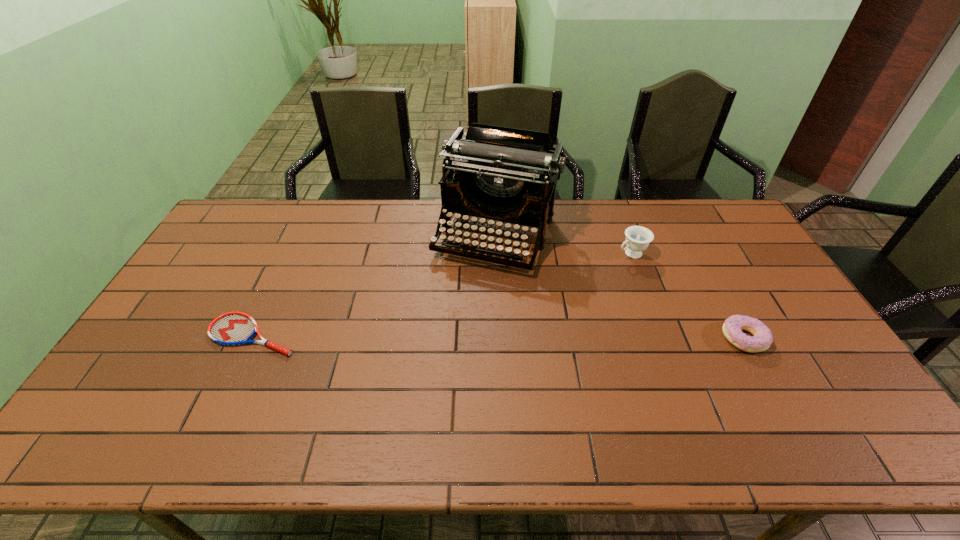
Locate an element on the screen. The image size is (960, 540). free space at the left edge is located at coordinates (241, 258).

This screenshot has height=540, width=960. I want to click on blank space at the right edge of the desktop, so click(770, 300).

Where is `vacant space at the far left corner of the desktop`? vacant space at the far left corner of the desktop is located at coordinates (266, 220).

You are a GUI agent. You are given a task and a screenshot of the screen. Output one action in this format:
    pyautogui.click(x=<x>, y=<y>)
    Task: Click on the free space between the third object from right to left and the teacup
    
    Given the screenshot: What is the action you would take?
    pyautogui.click(x=564, y=244)

Locate an element on the screen. The height and width of the screenshot is (540, 960). unoccupied position between the doughnut and the leftmost object is located at coordinates (499, 337).

You are a GUI agent. You are given a task and a screenshot of the screen. Output one action in this format:
    pyautogui.click(x=<x>, y=<y>)
    Task: Click on the free space between the leftmost object and the second tallest object
    The image size is (960, 540).
    Given the screenshot: What is the action you would take?
    pyautogui.click(x=443, y=294)

Image resolution: width=960 pixels, height=540 pixels. I want to click on free point between the second object from left to right and the teacup, so click(564, 244).

Identify the location of vacant space in between the third object from left to right and the rightmost object. The width and height of the screenshot is (960, 540). (687, 296).

Where is `free space between the shortest object and the third object from right to left`? free space between the shortest object and the third object from right to left is located at coordinates (375, 285).

This screenshot has width=960, height=540. I want to click on vacant space in between the tallest object and the teacup, so click(564, 244).